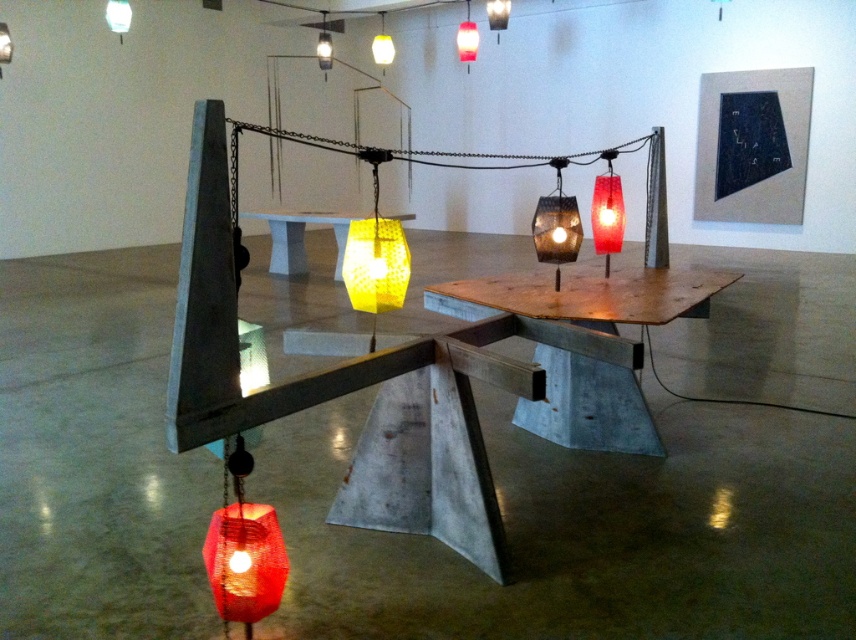
You are standing in the gallery and want to take a photo of the sculpture. You notice two points marked in the image at coordinates point (x=298, y=256) and point (x=497, y=28). If you want to ensure that both points are visible in your photo without any obstruction, which point should you position closer to the front of your camera frame?

To ensure both points are visible without obstruction, position point (x=497, y=28) closer to the front of your camera frame since point (x=298, y=256) is behind it.